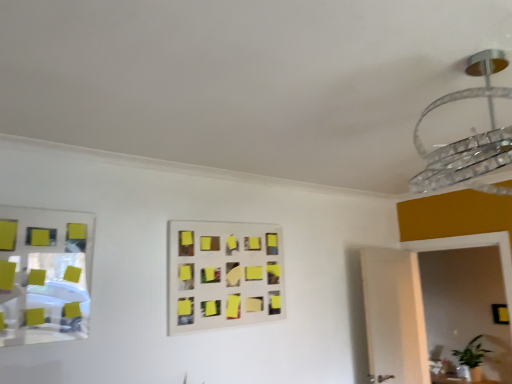
Question: From the image's perspective, is clear glass chandelier at upper right below black matte square at lower right?

Choices:
 (A) yes
 (B) no

Answer: (B)

Question: Can you confirm if clear glass chandelier at upper right is smaller than black matte square at lower right?

Choices:
 (A) yes
 (B) no

Answer: (B)

Question: Is clear glass chandelier at upper right wider than black matte square at lower right?

Choices:
 (A) no
 (B) yes

Answer: (B)

Question: Is black matte square at lower right located within clear glass chandelier at upper right?

Choices:
 (A) no
 (B) yes

Answer: (A)

Question: Is clear glass chandelier at upper right in front of black matte square at lower right?

Choices:
 (A) no
 (B) yes

Answer: (B)

Question: Is clear glass chandelier at upper right positioned beyond the bounds of black matte square at lower right?

Choices:
 (A) yes
 (B) no

Answer: (A)

Question: Is metallic reflective mirror at left smaller than clear glass chandelier at upper right?

Choices:
 (A) no
 (B) yes

Answer: (B)

Question: Does metallic reflective mirror at left appear on the right side of clear glass chandelier at upper right?

Choices:
 (A) no
 (B) yes

Answer: (A)

Question: Is metallic reflective mirror at left facing towards clear glass chandelier at upper right?

Choices:
 (A) no
 (B) yes

Answer: (A)

Question: From the image's perspective, is metallic reflective mirror at left on clear glass chandelier at upper right?

Choices:
 (A) yes
 (B) no

Answer: (B)

Question: Considering the relative sizes of metallic reflective mirror at left and clear glass chandelier at upper right in the image provided, is metallic reflective mirror at left taller than clear glass chandelier at upper right?

Choices:
 (A) no
 (B) yes

Answer: (B)

Question: Does metallic reflective mirror at left lie in front of clear glass chandelier at upper right?

Choices:
 (A) no
 (B) yes

Answer: (A)

Question: Considering the relative positions of black matte square at lower right and clear glass chandelier at upper right in the image provided, is black matte square at lower right to the right of clear glass chandelier at upper right from the viewer's perspective?

Choices:
 (A) yes
 (B) no

Answer: (A)